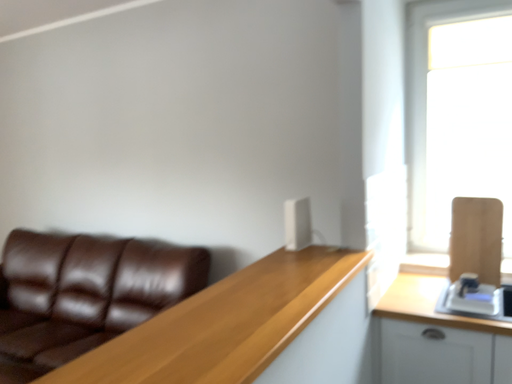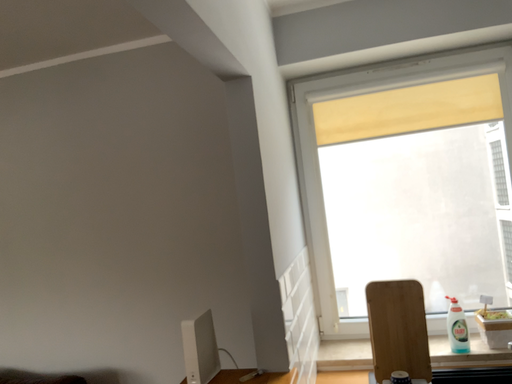
Question: How did the camera likely rotate when shooting the video?

Choices:
 (A) rotated left
 (B) rotated right

Answer: (B)